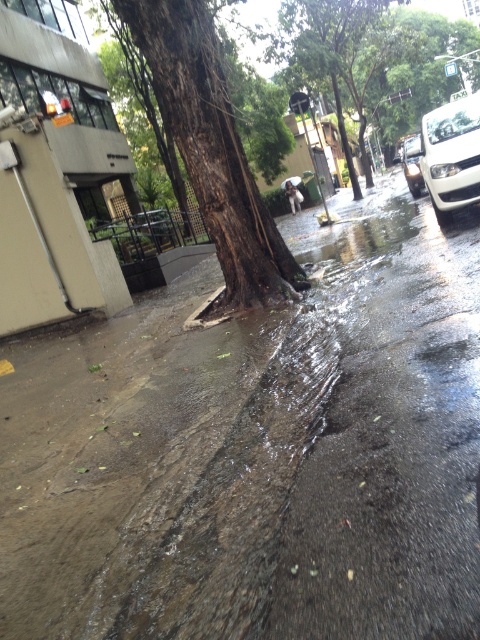
You are a delivery person trying to park your white glossy car at upper right near the brown rough bark tree at center. Considering their sizes, will the car fit in the space next to the tree without touching it?

The brown rough bark tree at center is smaller than the white glossy car at upper right. Therefore, the car may not fit in the space next to the tree without touching it, as the car is larger and requires more space.

You are a delivery person trying to navigate through the wet asphalt pavement at center and the green leafy tree at upper center. Which object is closer to you as you stand at the starting point?

The wet asphalt pavement at center is closer to the viewer than the green leafy tree at upper center, so the wet asphalt pavement at center would be closer to you as you stand at the starting point.

You are a delivery person trying to navigate through the wet asphalt pavement at center and the green leafy tree at upper center. Which object is located to the left of the other?

The wet asphalt pavement at center is positioned on the left side of green leafy tree at upper center, so the wet asphalt pavement at center is to the left of the green leafy tree at upper center.